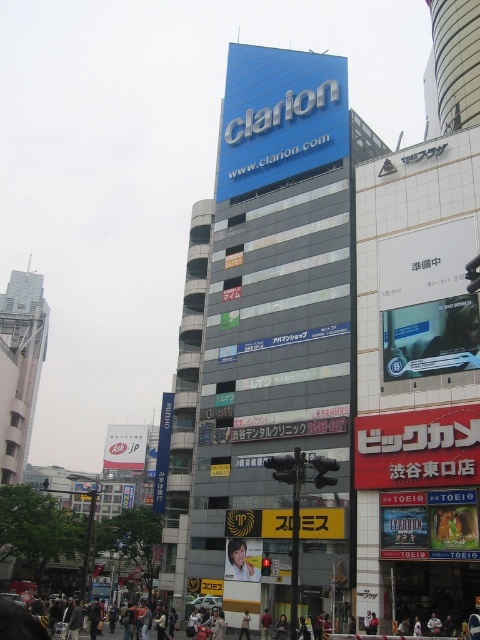
Question: Can you confirm if blue glossy sign at upper center is positioned above light brown leather jacket at center?

Choices:
 (A) yes
 (B) no

Answer: (A)

Question: Which is nearer to the blue glossy sign at upper center?

Choices:
 (A) light brown leather jacket at center
 (B) smooth plastic face at center

Answer: (B)

Question: Among these points, which one is nearest to the camera?

Choices:
 (A) (302, 172)
 (B) (251, 556)

Answer: (B)

Question: Which object appears closest to the camera in this image?

Choices:
 (A) blue glossy sign at upper center
 (B) smooth plastic face at center
 (C) light brown leather jacket at center

Answer: (C)

Question: Is blue glossy sign at upper center bigger than smooth plastic face at center?

Choices:
 (A) no
 (B) yes

Answer: (B)

Question: Does smooth plastic face at center come behind light brown leather jacket at center?

Choices:
 (A) no
 (B) yes

Answer: (B)